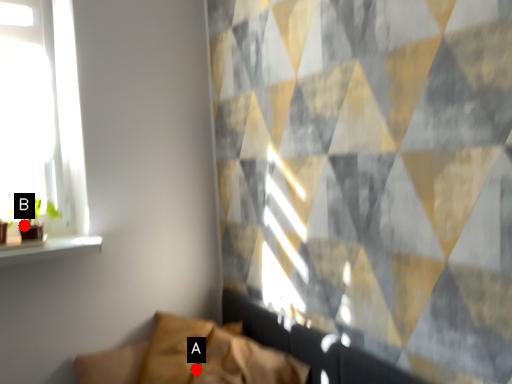
Question: Two points are circled on the image, labeled by A and B beside each circle. Among these points, which one is nearest to the camera?

Choices:
 (A) A is closer
 (B) B is closer

Answer: (A)